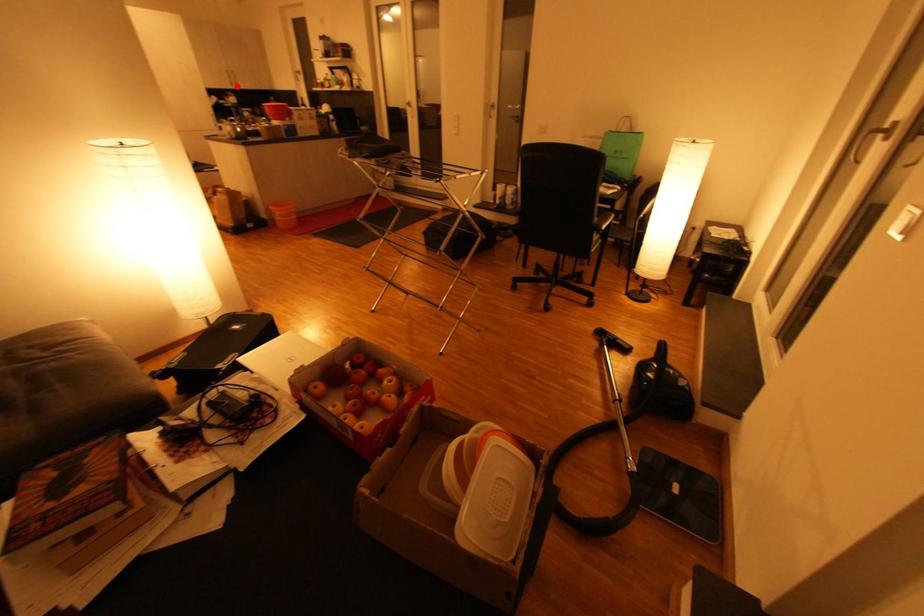
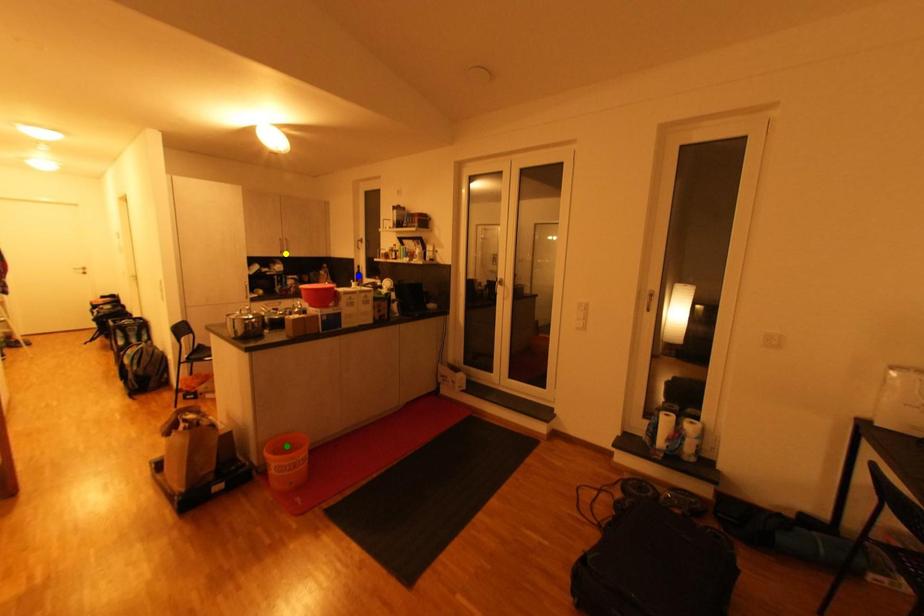
Question: I am providing you with two images of the same scene from different viewpoints. A red point is marked on the first image. You are given multiple points on the second image. Can you choose the point in image 2 that corresponds to the point in image 1?

Choices:
 (A) blue point
 (B) green point
 (C) yellow point

Answer: (C)